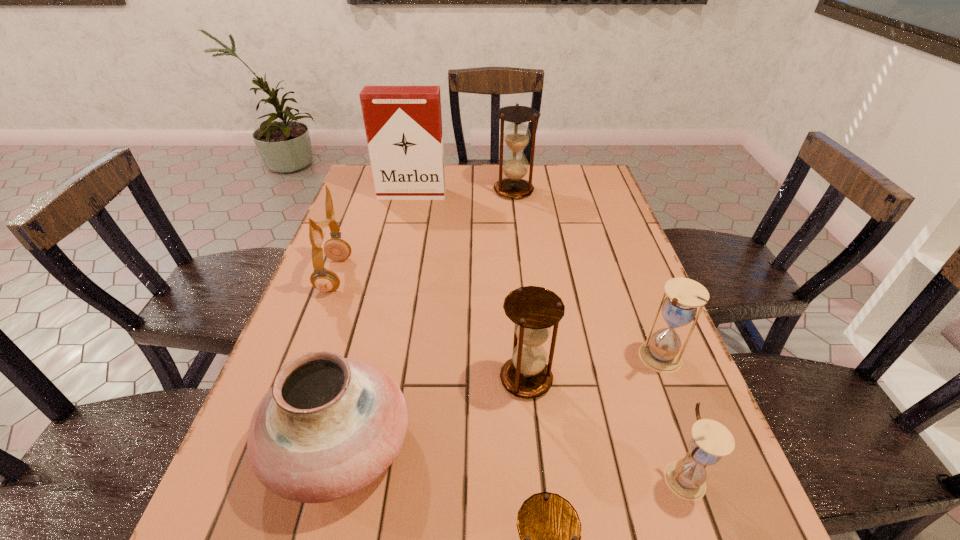
Locate an element on the screen. The height and width of the screenshot is (540, 960). cigarette_case is located at coordinates (403, 124).

Where is `the tallest object`? the tallest object is located at coordinates (403, 124).

I want to click on the tallest hourglass, so click(x=516, y=136).

What are the coordinates of `the biggest brown hourglass` in the screenshot? It's located at (516, 136).

Where is `earphone`? Image resolution: width=960 pixels, height=540 pixels. earphone is located at coordinates pos(325,280).

The image size is (960, 540). Find the location of `the third farthest object`. the third farthest object is located at coordinates (325, 280).

The width and height of the screenshot is (960, 540). Identify the location of the second biggest brown hourglass. (534, 310).

Identify the location of the bigger white hourglass. (661, 353).

Locate an element on the screen. This screenshot has width=960, height=540. pottery is located at coordinates (330, 426).

I want to click on the nearer white hourglass, so click(711, 440).